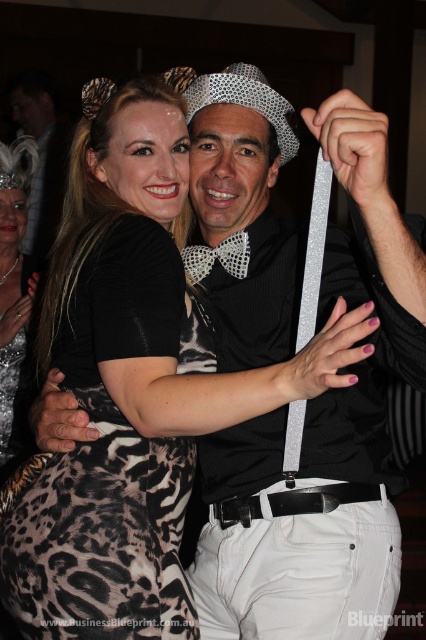
Question: Considering the real-world distances, which object is farthest from the leopard print fabric dress at center?

Choices:
 (A) leopard print dress at center
 (B) black dotted bowtie at center

Answer: (A)

Question: Is leopard print fabric dress at center smaller than leopard print dress at center?

Choices:
 (A) no
 (B) yes

Answer: (B)

Question: Does leopard print dress at center have a larger size compared to matte black bow tie at center?

Choices:
 (A) yes
 (B) no

Answer: (A)

Question: Which point appears closest to the camera in this image?

Choices:
 (A) (17, 234)
 (B) (236, 257)

Answer: (B)

Question: Which object is positioned closest to the leopard print dress at center?

Choices:
 (A) black dotted bowtie at center
 (B) matte black bow tie at center
 (C) leopard print fabric dress at center

Answer: (A)

Question: Is leopard print fabric dress at center smaller than matte black bow tie at center?

Choices:
 (A) no
 (B) yes

Answer: (B)